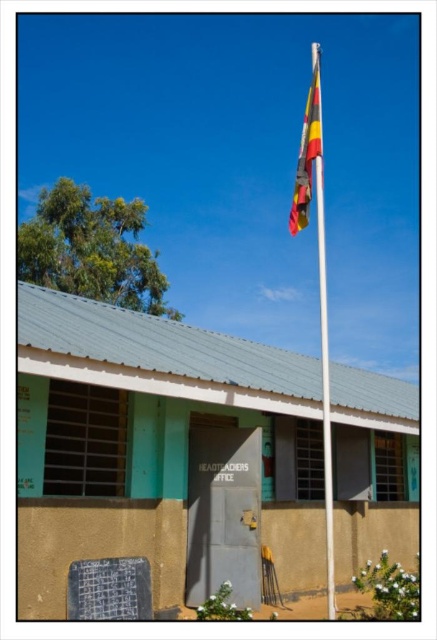
Question: Among these objects, which one is farthest from the camera?

Choices:
 (A) white plastic flag pole at center
 (B) multicolored fabric flag at center

Answer: (B)

Question: Among these objects, which one is farthest from the camera?

Choices:
 (A) white plastic flag pole at center
 (B) multicolored fabric flag at center

Answer: (B)

Question: In this image, where is white plastic flag pole at center located relative to multicolored fabric flag at center?

Choices:
 (A) below
 (B) above

Answer: (A)

Question: Does white plastic flag pole at center have a smaller size compared to multicolored fabric flag at center?

Choices:
 (A) no
 (B) yes

Answer: (A)

Question: Is white plastic flag pole at center to the right of multicolored fabric flag at center from the viewer's perspective?

Choices:
 (A) no
 (B) yes

Answer: (B)